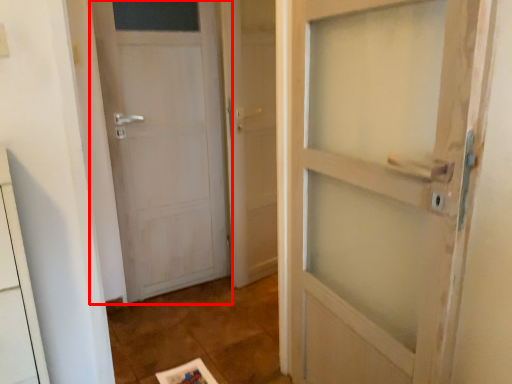
Question: From the image, what is the correct spatial relationship of door (annotated by the red box) in relation to screen door?

Choices:
 (A) left
 (B) right

Answer: (A)